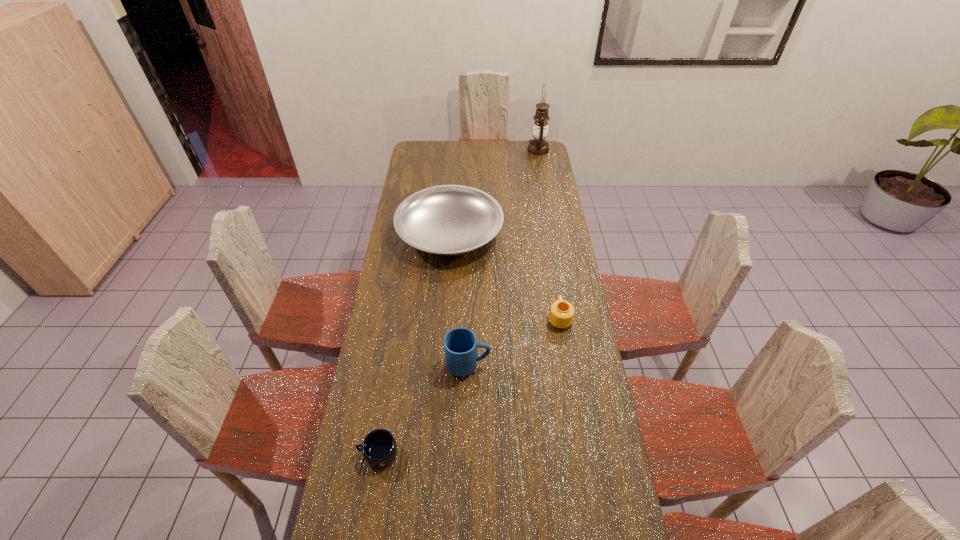
This screenshot has height=540, width=960. In order to click on free region that satisfies the following two spatial constraints: 1. on the front side of the tallest object; 2. with the handle on the side of the leftmost mug in this screenshot , I will do `click(591, 453)`.

You are a GUI agent. You are given a task and a screenshot of the screen. Output one action in this format:
    pyautogui.click(x=<x>, y=<y>)
    Task: Click on the free space in the image that satisfies the following two spatial constraints: 1. on the front side of the tallest object; 2. on the side of the second farthest mug with the handle
    
    Given the screenshot: What is the action you would take?
    pyautogui.click(x=576, y=366)

I want to click on blank space that satisfies the following two spatial constraints: 1. on the front side of the fourth nearest object; 2. with the handle on the side of the nearest mug, so click(x=434, y=453).